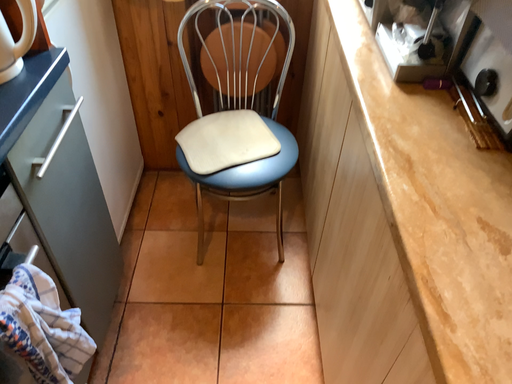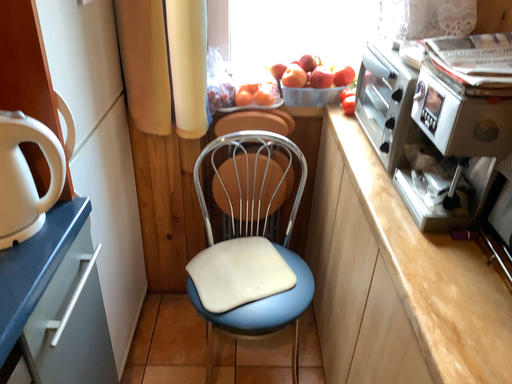
Question: Which way did the camera rotate in the video?

Choices:
 (A) rotated downward
 (B) rotated upward

Answer: (B)